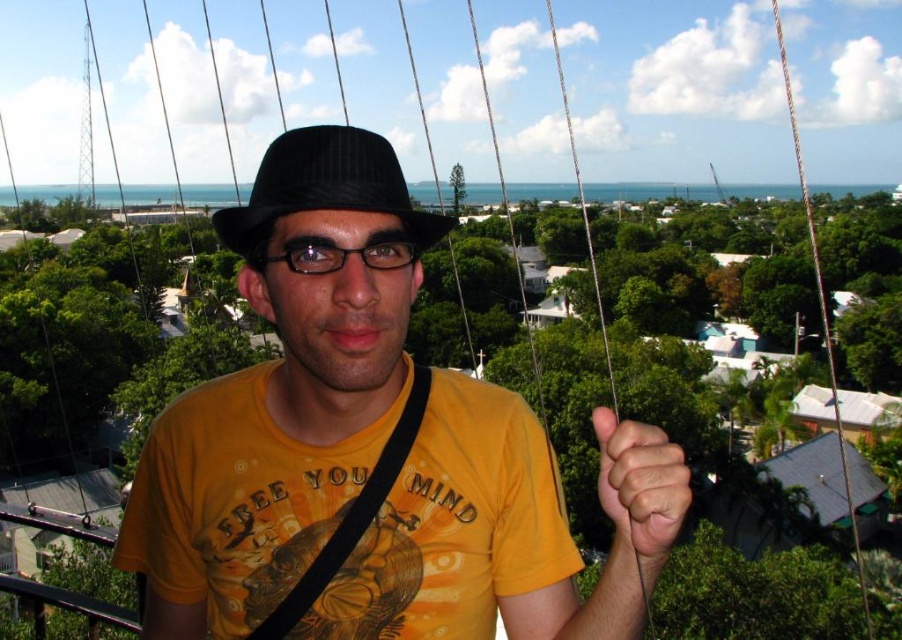
Can you confirm if matte black hat at center is wider than black pinstripe fedora at center?

Correct, the width of matte black hat at center exceeds that of black pinstripe fedora at center.

Who is more distant from viewer, (398, 275) or (279, 170)?

The point (398, 275) is behind.

Locate an element on the screen. This screenshot has width=902, height=640. matte black hat at center is located at coordinates (284, 392).

Which is below, black fabric strap at center or metallic wire at upper right?

black fabric strap at center is below.

Who is higher up, black fabric strap at center or metallic wire at upper right?

metallic wire at upper right

Locate an element on the screen. black fabric strap at center is located at coordinates (352, 515).

Who is positioned more to the left, black pinstripe fedora at center or metallic wire at upper right?

black pinstripe fedora at center

Is point (373, 168) closer to viewer compared to point (776, 35)?

Yes.

Is point (238, 225) positioned before point (835, 406)?

That is True.

Where is `black pinstripe fedora at center`? The width and height of the screenshot is (902, 640). black pinstripe fedora at center is located at coordinates (325, 188).